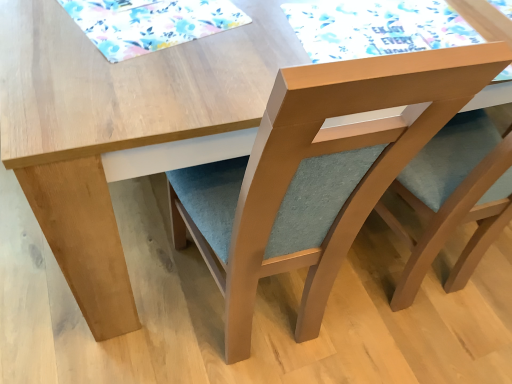
In order to click on vacant area that is situated to the right of floral fabric placemat at upper left, acting as the 1th mat starting from the left in this screenshot , I will do `click(284, 35)`.